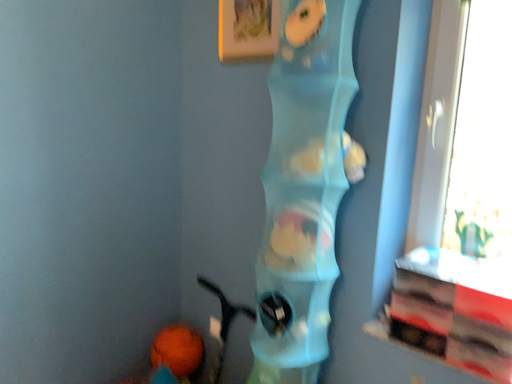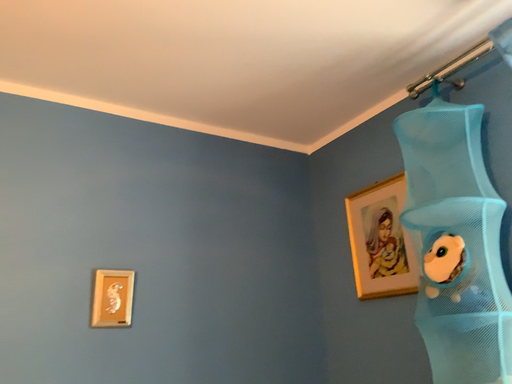
Question: Which way did the camera rotate in the video?

Choices:
 (A) rotated left
 (B) rotated right

Answer: (A)